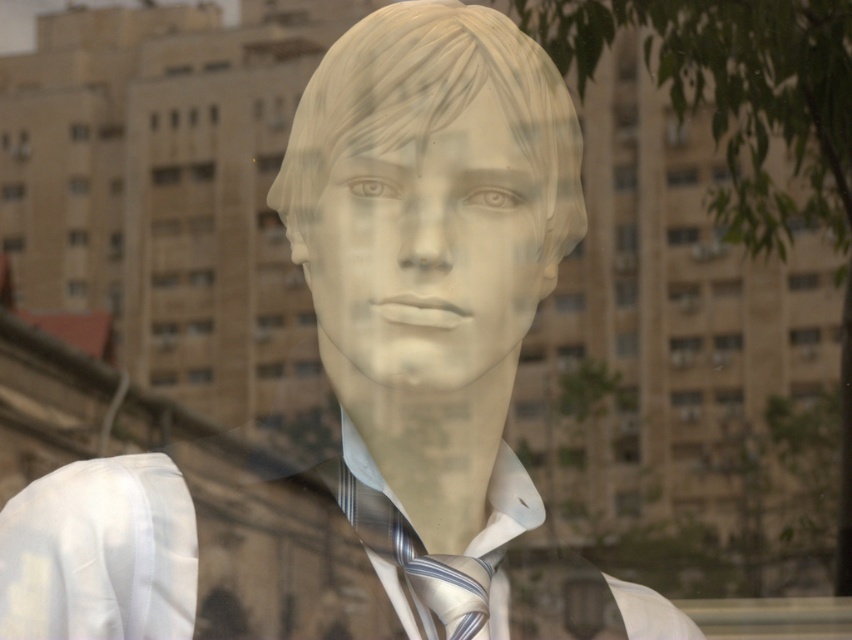
You are a window cleaner working on the storefront. You need to clean the glass surface in front of the white silk dress shirt at center. Can you reach it without moving the matte white mannequin head at center?

The matte white mannequin head at center is in front of the white silk dress shirt at center, so you can not reach the glass surface in front of the white silk dress shirt at center without moving the matte white mannequin head at center first.

In the scene shown: You are a tailor who needs to determine which item has a greater width between the white silk dress shirt at center and the striped silk tie at center. Which one should you choose?

The white silk dress shirt at center has a larger width than the striped silk tie at center according to the description.

You are a window cleaner working on the storefront. You need to clean the glass surface where the white matte mannequin head at center and the white silk dress shirt at center are displayed. Which object has a wider base so you can place your cleaning tools on it?

The white matte mannequin head at center has a wider base than the white silk dress shirt at center, so you can place your cleaning tools on it.